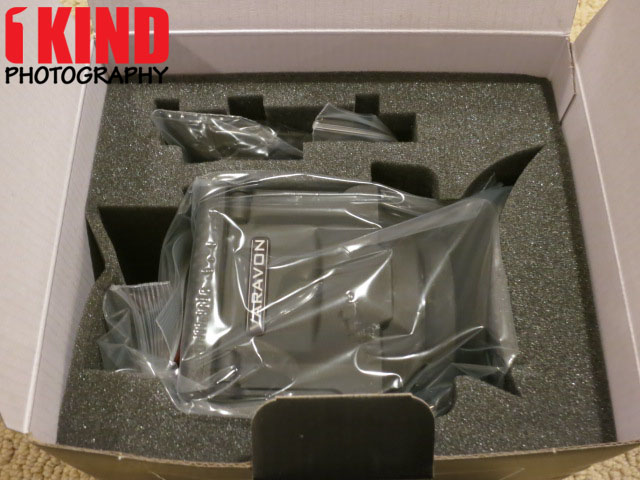
Locate an element on the screen. Image resolution: width=640 pixels, height=480 pixels. white walls is located at coordinates (630, 166), (377, 27), (36, 140).